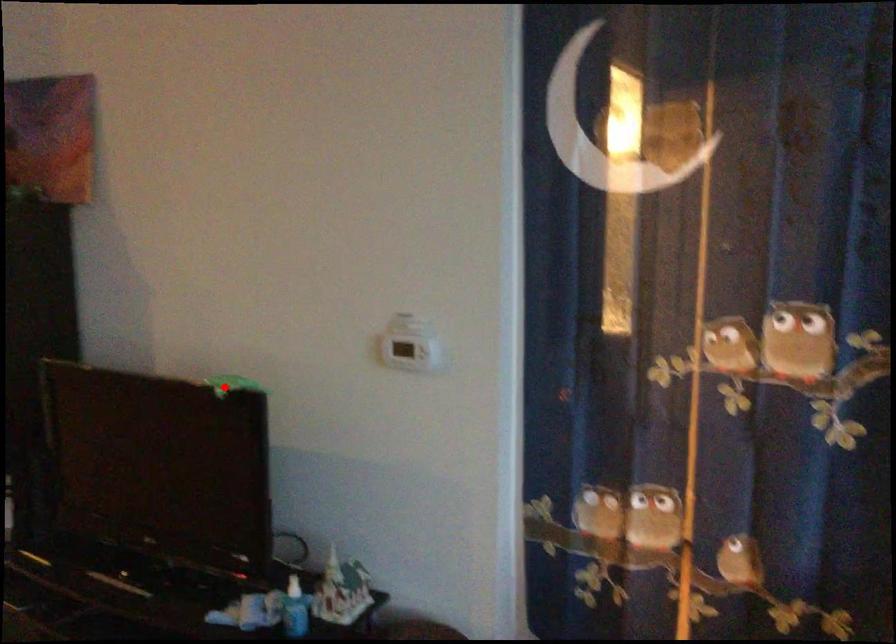
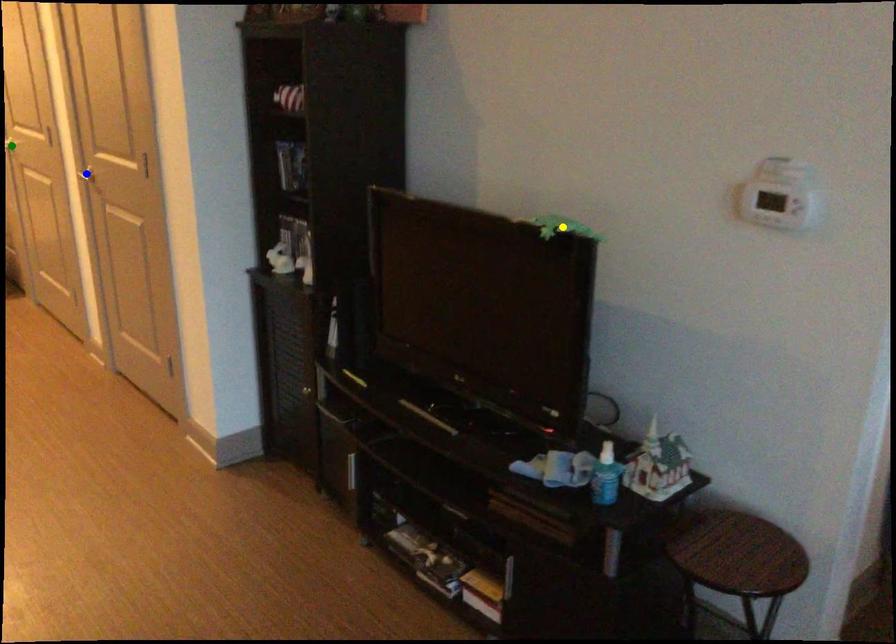
Question: I am providing you with two images of the same scene from different viewpoints. A red point is marked on the first image. You are given multiple points on the second image. Which point in image 2 is actually the same real-world point as the red point in image 1?

Choices:
 (A) green point
 (B) yellow point
 (C) blue point

Answer: (B)